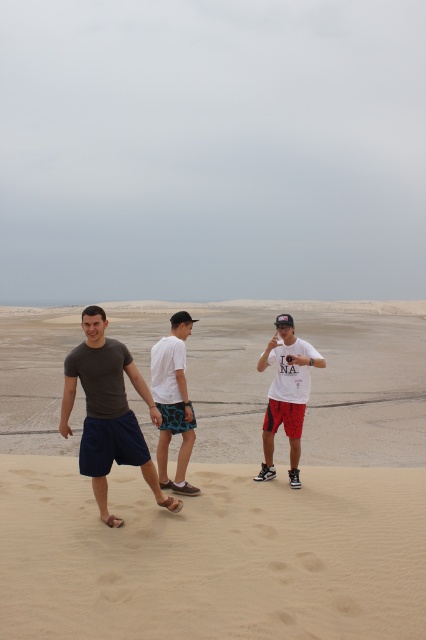
Question: Among these objects, which one is farthest from the camera?

Choices:
 (A) white matte t-shirt at center
 (B) beige sandy beach at lower center
 (C) dark gray matte t-shirt at center
 (D) white matte shorts at center

Answer: (A)

Question: Which point appears closest to the camera in this image?

Choices:
 (A) (265, 573)
 (B) (106, 426)
 (C) (178, 362)
 (D) (290, 461)

Answer: (A)

Question: Can you confirm if dark gray matte t-shirt at center is smaller than white matte shorts at center?

Choices:
 (A) no
 (B) yes

Answer: (A)

Question: Does dark gray matte t-shirt at center lie behind white matte t-shirt at center?

Choices:
 (A) yes
 (B) no

Answer: (B)

Question: Can you confirm if beige sandy beach at lower center is positioned above dark gray matte t-shirt at center?

Choices:
 (A) yes
 (B) no

Answer: (B)

Question: Which object is positioned closest to the white matte t-shirt at center?

Choices:
 (A) white matte shorts at center
 (B) beige sandy beach at lower center

Answer: (A)